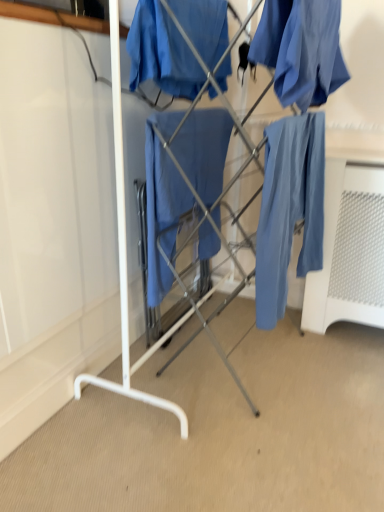
The width and height of the screenshot is (384, 512). What are the coordinates of `vacant location below matte blue fabric at center, the 2th clothing viewed from the right (from a real-world perspective)` in the screenshot? It's located at (177, 340).